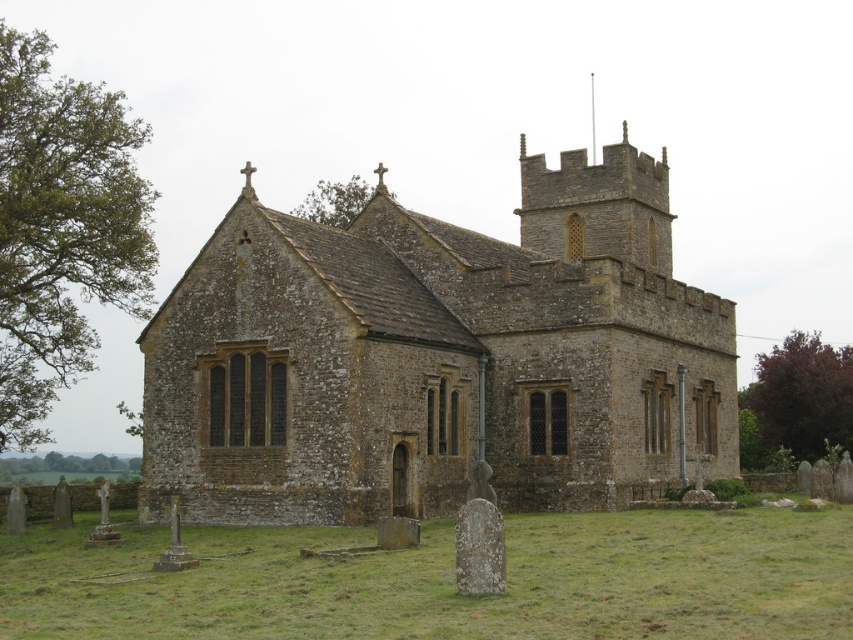
Question: From the image, what is the correct spatial relationship of purple leafy tree at right in relation to green leafy tree at lower left?

Choices:
 (A) above
 (B) below

Answer: (A)

Question: Is brown stone church at center to the right of purple leafy tree at right from the viewer's perspective?

Choices:
 (A) no
 (B) yes

Answer: (A)

Question: Which point is farther from the camera taking this photo?

Choices:
 (A) (21, 468)
 (B) (80, 202)
 (C) (834, 435)

Answer: (A)

Question: Does brown stone church at center have a smaller size compared to purple leafy tree at right?

Choices:
 (A) no
 (B) yes

Answer: (A)

Question: Which object is closer to the camera taking this photo?

Choices:
 (A) green leafy tree at upper center
 (B) green leafy tree at left
 (C) brown stone church at center
 (D) green leafy tree at lower left

Answer: (C)

Question: Based on their relative distances, which object is nearer to the green leafy tree at lower left?

Choices:
 (A) brown stone church at center
 (B) green leafy tree at upper center
 (C) purple leafy tree at right
 (D) green leafy tree at left

Answer: (D)